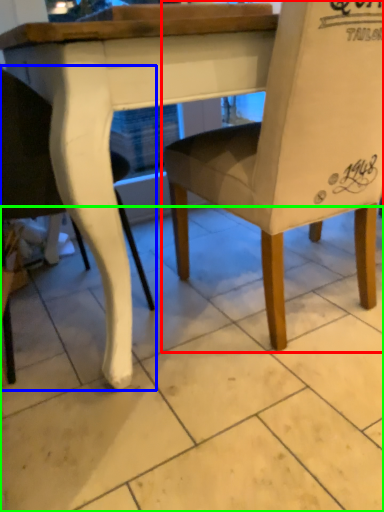
Question: Which object is positioned closest to chair (highlighted by a red box)? Select from chair (highlighted by a blue box) and tile (highlighted by a green box).

Choices:
 (A) chair
 (B) tile

Answer: (B)